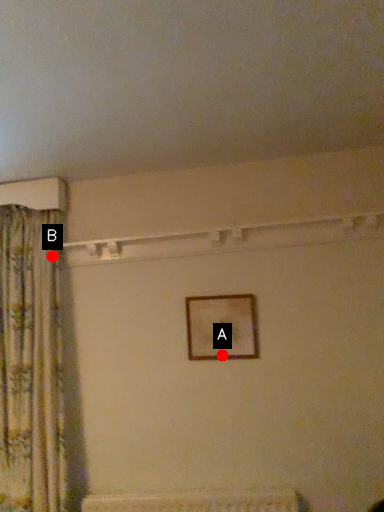
Question: Two points are circled on the image, labeled by A and B beside each circle. Which point is farther from the camera taking this photo?

Choices:
 (A) A is further
 (B) B is further

Answer: (B)